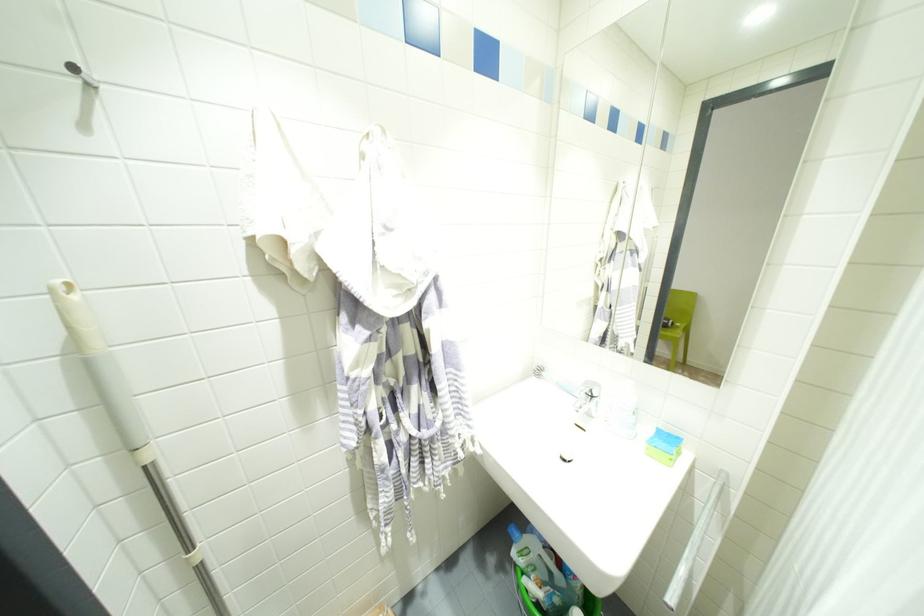
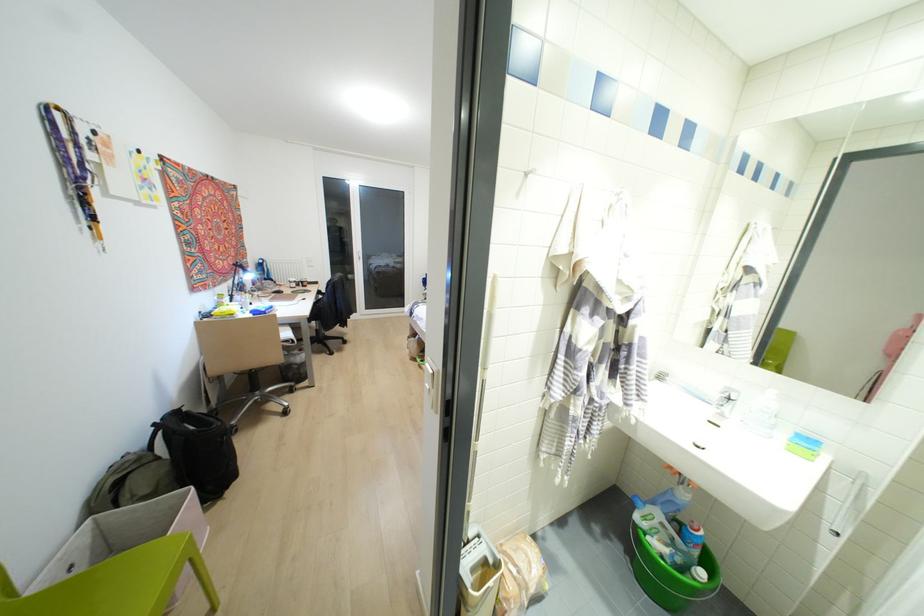
Question: The camera is either moving clockwise (left) or counter-clockwise (right) around the object. The first image is from the beginning of the video and the second image is from the end. Is the camera moving left or right when shooting the video?

Choices:
 (A) Left
 (B) Right

Answer: (B)